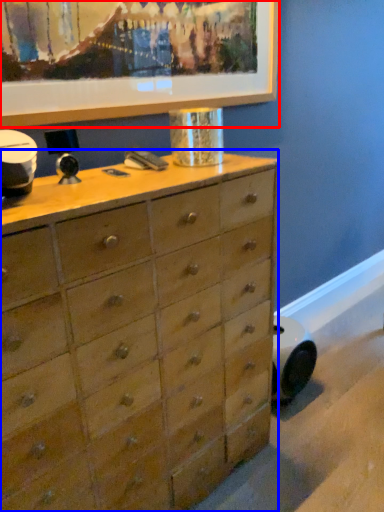
Question: Which object appears farthest to the camera in this image, picture frame (highlighted by a red box) or chest of drawers (highlighted by a blue box)?

Choices:
 (A) picture frame
 (B) chest of drawers

Answer: (A)